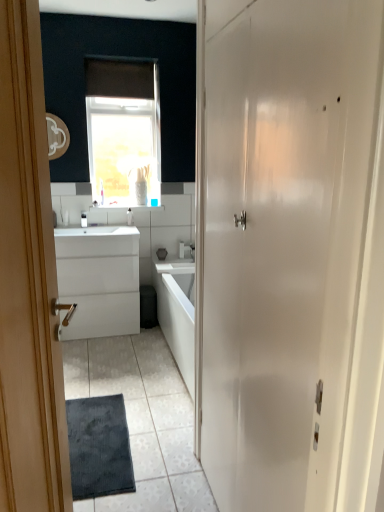
Question: Is white glossy sink at center inside the boundaries of white plastic toothbrush at center, which is the 1th toiletry in left-to-right order, or outside?

Choices:
 (A) outside
 (B) inside

Answer: (A)

Question: Is white glossy sink at center in front of or behind white plastic toothbrush at center, which is the 2th toiletry in right-to-left order, in the image?

Choices:
 (A) front
 (B) behind

Answer: (A)

Question: Estimate the real-world distances between objects in this image. Which object is farther from the satin nickel faucet at center?

Choices:
 (A) white glossy door at right, positioned as the second door in left-to-right order
 (B) white plastic toothbrush at upper center, which is counted as the 2th toiletry, starting from the left
 (C) white plastic toothbrush at center, which is the 2th toiletry in right-to-left order
 (D) white glossy cabinet at center
 (E) dark gray textured bath mat at lower center

Answer: (A)

Question: Which object is the farthest from the wooden door at left, which is the second door in right-to-left order?

Choices:
 (A) dark gray textured mat at lower left
 (B) dark gray textured bath mat at lower center
 (C) white plastic toothbrush at center, which is the 2th toiletry in right-to-left order
 (D) white glossy door at right, which ranks as the first door in right-to-left order
 (E) brown matte window at upper center

Answer: (C)